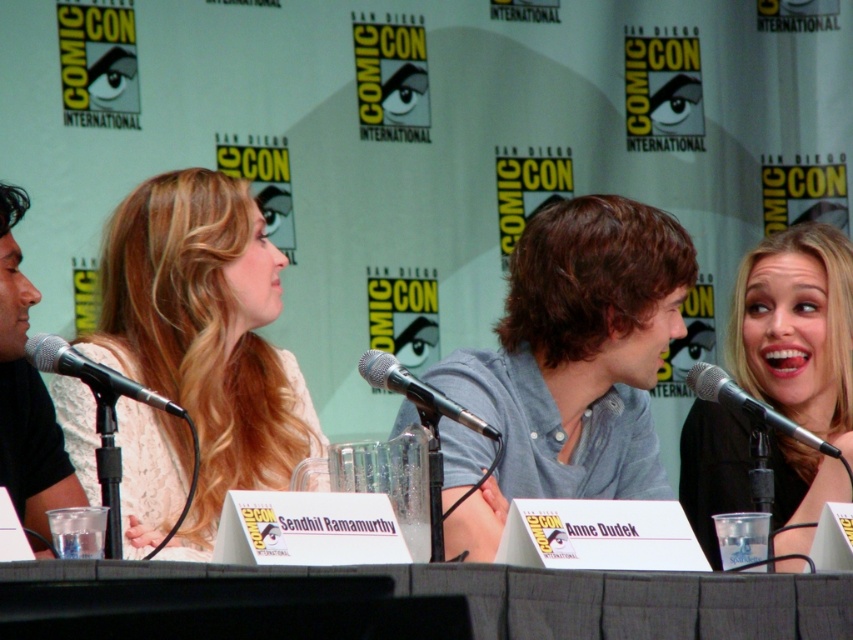
Which is below, white lace dress at left or black metallic microphone at center?

white lace dress at left is below.

Between white lace dress at left and black metallic microphone at center, which one is positioned higher?

black metallic microphone at center is above.

Is point (166, 230) farther from camera compared to point (397, 384)?

Yes, it is.

Identify the location of white lace dress at left. (206, 332).

Who is lower down, gray cotton shirt at center or gray fabric table at center?

Positioned lower is gray fabric table at center.

Can you confirm if gray cotton shirt at center is taller than gray fabric table at center?

Indeed, gray cotton shirt at center has a greater height compared to gray fabric table at center.

Describe the element at coordinates (573, 362) in the screenshot. I see `gray cotton shirt at center` at that location.

The image size is (853, 640). In order to click on gray cotton shirt at center in this screenshot , I will do (x=573, y=362).

Which of these two, black matte hair at upper right or silver metallic microphone at left, stands taller?

With more height is black matte hair at upper right.

Is black matte hair at upper right further to camera compared to silver metallic microphone at left?

Yes, it is.

The width and height of the screenshot is (853, 640). I want to click on black matte hair at upper right, so click(x=798, y=328).